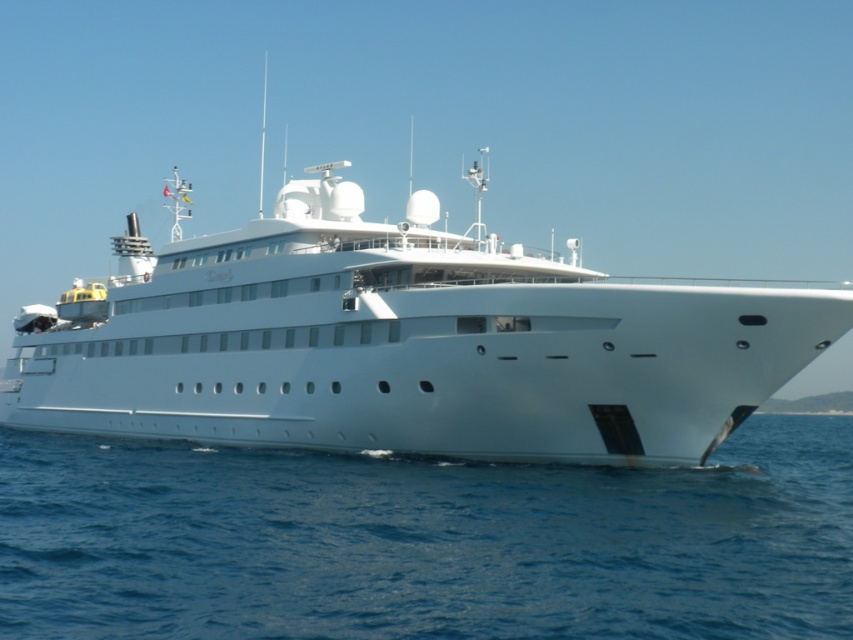
Who is positioned more to the right, white glossy yacht at center or blue water at lower right?

blue water at lower right is more to the right.

Is the position of white glossy yacht at center less distant than that of blue water at lower right?

No, it is not.

From the picture: Who is more distant from viewer, (x=337, y=428) or (x=781, y=547)?

Point (x=337, y=428)

This screenshot has height=640, width=853. What are the coordinates of `white glossy yacht at center` in the screenshot? It's located at (403, 342).